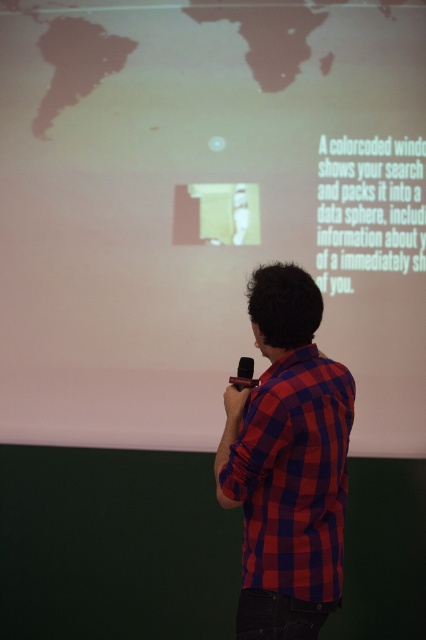
Question: Is white matte projection screen at upper center to the right of red checkered shirt at center from the viewer's perspective?

Choices:
 (A) yes
 (B) no

Answer: (B)

Question: Is the position of white matte projection screen at upper center more distant than that of red checkered shirt at center?

Choices:
 (A) yes
 (B) no

Answer: (A)

Question: Which point appears closest to the camera in this image?

Choices:
 (A) (313, 307)
 (B) (252, 17)

Answer: (A)

Question: Can you confirm if white matte projection screen at upper center is bigger than red checkered shirt at center?

Choices:
 (A) no
 (B) yes

Answer: (B)

Question: Which point appears farthest from the camera in this image?

Choices:
 (A) (305, 636)
 (B) (212, 372)

Answer: (B)